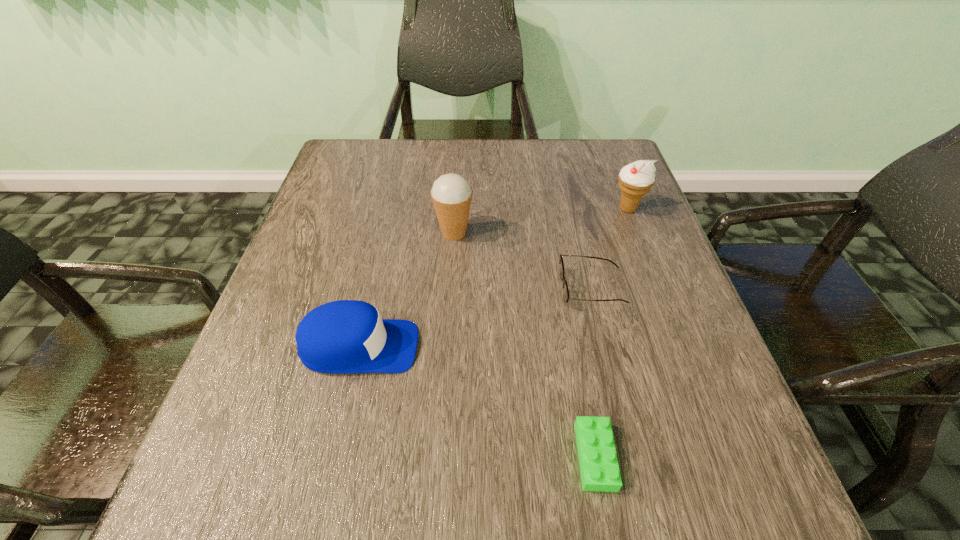
In order to click on the left icecream in this screenshot , I will do `click(451, 193)`.

At what (x,y) coordinates should I click in order to perform the action: click on the nearer icecream. Please return your answer as a coordinate pair (x, y). Looking at the image, I should click on (451, 193).

This screenshot has width=960, height=540. Identify the location of the right icecream. pos(636,179).

In order to click on the farther icecream in this screenshot , I will do `click(636, 179)`.

What are the coordinates of `the third tallest object` in the screenshot? It's located at (346, 336).

Where is `the leftmost object`? the leftmost object is located at coordinates (346, 336).

You are a GUI agent. You are given a task and a screenshot of the screen. Output one action in this format:
    pyautogui.click(x=<x>, y=<y>)
    Task: Click on the spectacles
    Image resolution: width=960 pixels, height=540 pixels.
    Given the screenshot: What is the action you would take?
    coord(566,297)

I want to click on the second shortest object, so click(x=566, y=297).

Where is `the nearest object`? Image resolution: width=960 pixels, height=540 pixels. the nearest object is located at coordinates (599, 467).

You are a GUI agent. You are given a task and a screenshot of the screen. Output one action in this format:
    pyautogui.click(x=<x>, y=<y>)
    Task: Click on the shortest object
    The height and width of the screenshot is (540, 960).
    Given the screenshot: What is the action you would take?
    pyautogui.click(x=599, y=467)